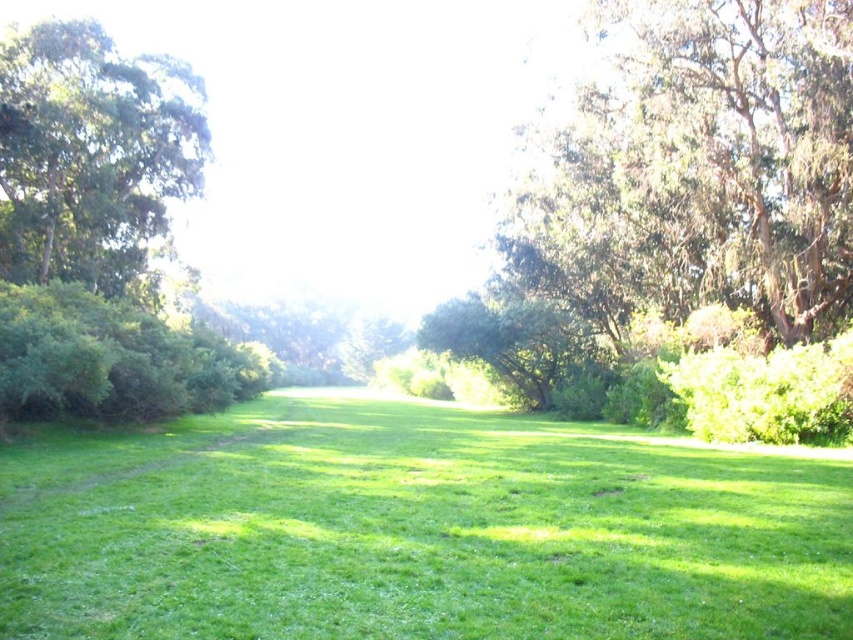
You are standing in the park and want to find a spot where you can see both the green leafy tree at upper right and the green leafy tree at left. Which tree is closer to the ground? Based on their positions, where should you stand to see both trees clearly?

The green leafy tree at upper right is below the green leafy tree at left, so it is closer to the ground. To see both trees clearly, you should stand between them, ensuring you are not blocked by the taller tree at left.

You are planning to set up a picnic in the park. The picnic blanket you have is 2 meters wide. Considering the green grassy field at center and the green leafy tree at upper right, which area can accommodate your blanket without overlapping the tree?

The green grassy field at center can accommodate the picnic blanket since its width surpasses the green leafy tree at upper right, meaning the field is wider than the tree and can fit the 2m blanket without overlapping.